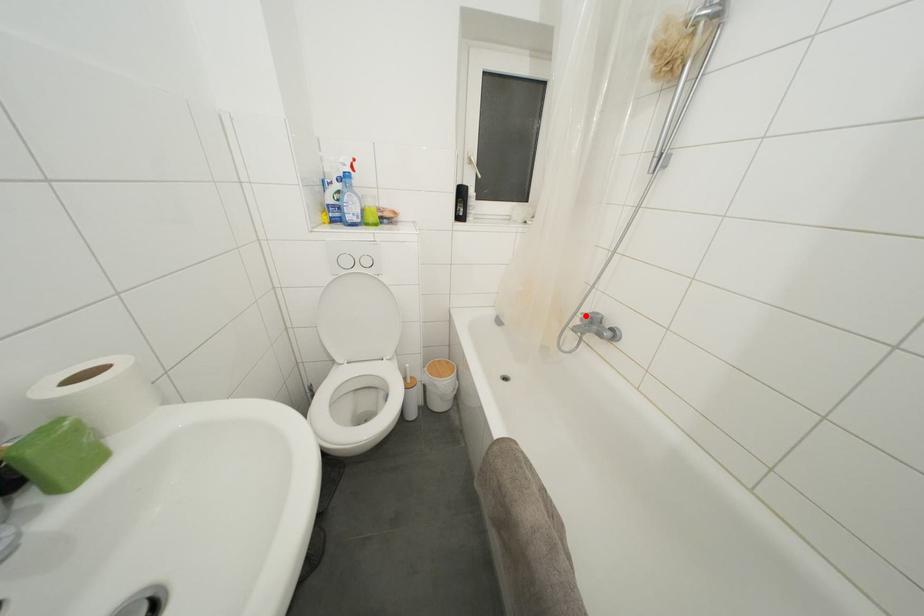
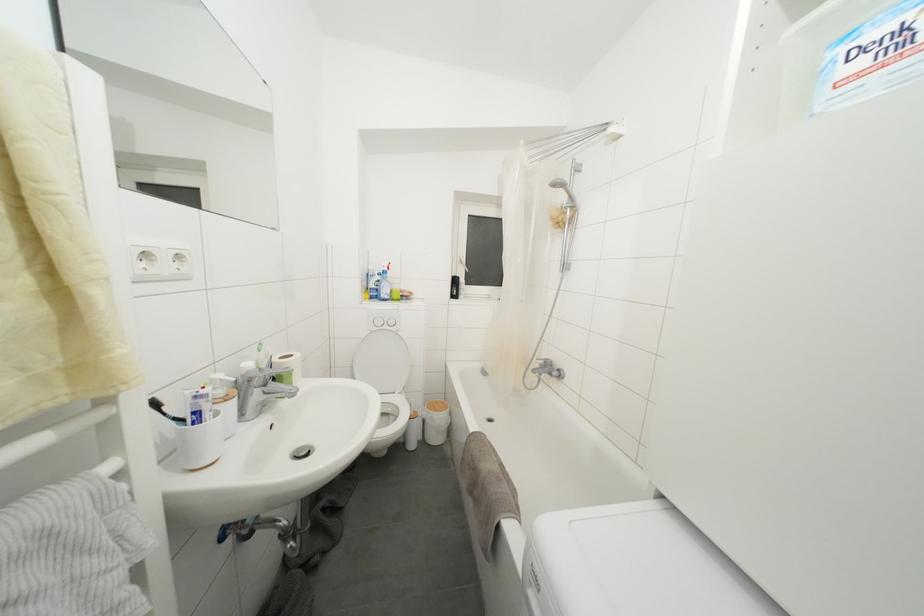
Locate, in the second image, the point that corresponds to the highlighted location in the first image.

(540, 362)